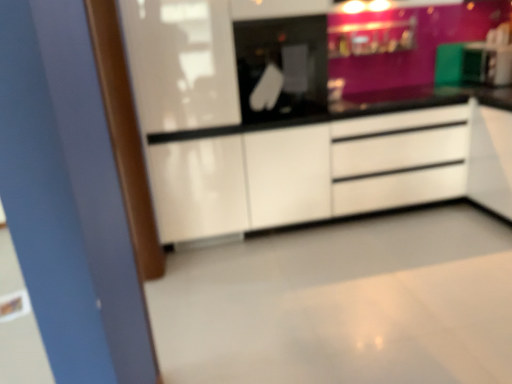
Measure the distance between black glass microwave at center and camera.

black glass microwave at center is 2.60 meters away from camera.

Identify the location of black glass microwave at center. The height and width of the screenshot is (384, 512). (283, 65).

What do you see at coordinates (283, 65) in the screenshot? I see `black glass microwave at center` at bounding box center [283, 65].

The height and width of the screenshot is (384, 512). What do you see at coordinates (401, 161) in the screenshot? I see `white glossy chest of drawers at center` at bounding box center [401, 161].

Where is `white glossy chest of drawers at center`? The height and width of the screenshot is (384, 512). white glossy chest of drawers at center is located at coordinates (401, 161).

Where is `black glass microwave at center`? Image resolution: width=512 pixels, height=384 pixels. black glass microwave at center is located at coordinates (283, 65).

Between white glossy chest of drawers at center and black glass microwave at center, which one appears on the left side from the viewer's perspective?

Positioned to the left is black glass microwave at center.

Is white glossy chest of drawers at center closer to camera compared to black glass microwave at center?

No, white glossy chest of drawers at center is further to the viewer.

Does point (464, 118) come closer to viewer compared to point (320, 40)?

No.

Looking at this image, from the image's perspective, between white glossy chest of drawers at center and black glass microwave at center, which one is located above?

black glass microwave at center appears higher in the image.

From a real-world perspective, is white glossy chest of drawers at center physically above black glass microwave at center?

Incorrect, from a real-world perspective, white glossy chest of drawers at center is lower than black glass microwave at center.

Is white glossy chest of drawers at center thinner than black glass microwave at center?

Incorrect, the width of white glossy chest of drawers at center is not less than that of black glass microwave at center.

Considering the relative sizes of white glossy chest of drawers at center and black glass microwave at center in the image provided, is white glossy chest of drawers at center taller than black glass microwave at center?

Correct, white glossy chest of drawers at center is much taller as black glass microwave at center.

Consider the image. Can you confirm if white glossy chest of drawers at center is smaller than black glass microwave at center?

No.

Can we say white glossy chest of drawers at center lies outside black glass microwave at center?

white glossy chest of drawers at center lies outside black glass microwave at center's area.

Does white glossy chest of drawers at center touch black glass microwave at center?

No, white glossy chest of drawers at center is not next to black glass microwave at center.

Does white glossy chest of drawers at center turn towards black glass microwave at center?

No, white glossy chest of drawers at center is not oriented towards black glass microwave at center.

Can you tell me how much white glossy chest of drawers at center and black glass microwave at center differ in facing direction?

The angular difference between white glossy chest of drawers at center and black glass microwave at center is 1.2 degrees.

At what (x,y) coordinates should I click in order to perform the action: click on the chest of drawers lying below the black glass microwave at center (from the image's perspective). Please return your answer as a coordinate pair (x, y). This screenshot has height=384, width=512. Looking at the image, I should click on (401, 161).

Considering the relative positions of black glass microwave at center and white glossy chest of drawers at center in the image provided, is black glass microwave at center to the right of white glossy chest of drawers at center from the viewer's perspective?

No, black glass microwave at center is not to the right of white glossy chest of drawers at center.

Is black glass microwave at center in front of or behind white glossy chest of drawers at center in the image?

Visually, black glass microwave at center is located in front of white glossy chest of drawers at center.

Does point (309, 78) appear closer or farther from the camera than point (347, 161)?

Point (309, 78) is positioned closer to the camera compared to point (347, 161).

From the image's perspective, is black glass microwave at center under white glossy chest of drawers at center?

No.

From a real-world perspective, who is located lower, black glass microwave at center or white glossy chest of drawers at center?

From a 3D spatial view, white glossy chest of drawers at center is below.

Considering the sizes of objects black glass microwave at center and white glossy chest of drawers at center in the image provided, who is thinner, black glass microwave at center or white glossy chest of drawers at center?

black glass microwave at center is thinner.

In terms of height, does black glass microwave at center look taller or shorter compared to white glossy chest of drawers at center?

Considering their sizes, black glass microwave at center has less height than white glossy chest of drawers at center.

Which of these two, black glass microwave at center or white glossy chest of drawers at center, is bigger?

white glossy chest of drawers at center is bigger.

Can white glossy chest of drawers at center be found inside black glass microwave at center?

No, white glossy chest of drawers at center is not a part of black glass microwave at center.

Are black glass microwave at center and white glossy chest of drawers at center making contact?

They are not placed beside each other.

Is black glass microwave at center oriented away from white glossy chest of drawers at center?

black glass microwave at center does not have its back to white glossy chest of drawers at center.

Find the location of a particular element. This screenshot has width=512, height=384. appliance lying above the white glossy chest of drawers at center (from the image's perspective) is located at coordinates (283, 65).

I want to click on chest of drawers on the right of the black glass microwave at center, so click(x=401, y=161).

This screenshot has width=512, height=384. What are the coordinates of `appliance on the left side of white glossy chest of drawers at center` in the screenshot? It's located at (283, 65).